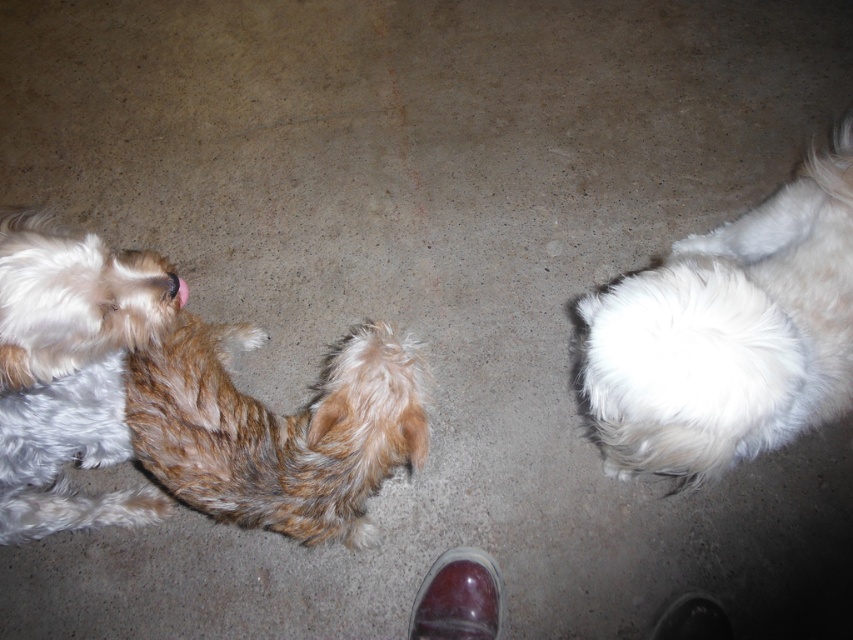
You are a dog trainer observing two dogs in a dimly lit area. You notice the brown fuzzy tail at center and the brown shaggy dog at left. Which of these two has a shorter length?

The brown fuzzy tail at center is shorter than the brown shaggy dog at left.

You are a dog trainer observing two dogs in a training session. You notice the brown fuzzy tail at center and the brown shaggy dog at left. Which of these two has a wider tail?

The brown fuzzy tail at center has a larger width than the brown shaggy dog at left, so the brown fuzzy tail at center has a wider tail.

You are a photographer setting up a shot of the two dogs. You want to focus on the point closer to the camera. Which point should you choose between point (421,396) and point (56,369)?

Point (421,396) is further to the camera than point (56,369), so you should choose point (421,396) to focus on the closer point.